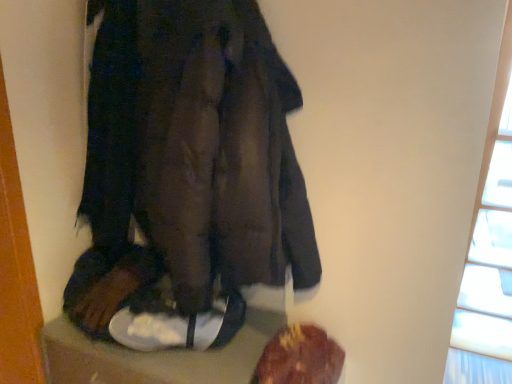
Describe the element at coordinates (188, 175) in the screenshot. I see `dark brown leather coat at center` at that location.

You are a GUI agent. You are given a task and a screenshot of the screen. Output one action in this format:
    pyautogui.click(x=<x>, y=<y>)
    Task: Click on the transparent glass window at upper right
    The width and height of the screenshot is (512, 384).
    Given the screenshot: What is the action you would take?
    pyautogui.click(x=487, y=271)

Measure the distance between point (291, 329) and camera.

The distance of point (291, 329) from camera is 4.53 feet.

Where is `dark brown leather coat at center`? dark brown leather coat at center is located at coordinates (188, 175).

Which of these two, brown crumbly bread at lower right or dark brown leather coat at center, is bigger?

Bigger between the two is dark brown leather coat at center.

Can dark brown leather coat at center be found inside brown crumbly bread at lower right?

That's incorrect, dark brown leather coat at center is not inside brown crumbly bread at lower right.

Looking at this image, between brown crumbly bread at lower right and dark brown leather coat at center, which one has larger width?

dark brown leather coat at center.

What's the angular difference between brown crumbly bread at lower right and dark brown leather coat at center's facing directions?

The angular difference between brown crumbly bread at lower right and dark brown leather coat at center is 0.000512 degrees.

Which is behind, point (480, 207) or point (298, 346)?

The point (480, 207) is farther.

Is transparent glass window at upper right located outside brown crumbly bread at lower right?

That's correct, transparent glass window at upper right is outside of brown crumbly bread at lower right.

Consider the image. How different are the orientations of transparent glass window at upper right and brown crumbly bread at lower right in degrees?

The angular difference between transparent glass window at upper right and brown crumbly bread at lower right is 180 degrees.

Which object is thinner, transparent glass window at upper right or brown crumbly bread at lower right?

brown crumbly bread at lower right.

Between dark brown leather coat at center and brown crumbly bread at lower right, which one is positioned in front?

dark brown leather coat at center.

Would you consider dark brown leather coat at center to be distant from brown crumbly bread at lower right?

They are positioned close to each other.

Considering the points (282, 280) and (314, 364), which point is in front, point (282, 280) or point (314, 364)?

The point (282, 280) is closer to the camera.

Would you say dark brown leather coat at center is inside or outside brown crumbly bread at lower right?

dark brown leather coat at center is spatially situated outside brown crumbly bread at lower right.

Does transparent glass window at upper right have a greater height compared to dark brown leather coat at center?

Yes, transparent glass window at upper right is taller than dark brown leather coat at center.

Considering the points (457, 346) and (298, 278), which point is behind, point (457, 346) or point (298, 278)?

Point (457, 346)

Considering the relative sizes of transparent glass window at upper right and dark brown leather coat at center in the image provided, is transparent glass window at upper right smaller than dark brown leather coat at center?

No.

Find the location of a particular element. This screenshot has width=512, height=384. window below the dark brown leather coat at center (from the image's perspective) is located at coordinates (487, 271).

Can you confirm if dark brown leather coat at center is shorter than transparent glass window at upper right?

Correct, dark brown leather coat at center is not as tall as transparent glass window at upper right.

Considering the positions of objects dark brown leather coat at center and transparent glass window at upper right in the image provided, who is behind, dark brown leather coat at center or transparent glass window at upper right?

transparent glass window at upper right is more distant.

Is dark brown leather coat at center looking in the opposite direction of transparent glass window at upper right?

No, transparent glass window at upper right is not at the back of dark brown leather coat at center.

Can you tell me how much brown crumbly bread at lower right and transparent glass window at upper right differ in facing direction?

There is a 180-degree angle between the facing directions of brown crumbly bread at lower right and transparent glass window at upper right.

Who is smaller, brown crumbly bread at lower right or transparent glass window at upper right?

With smaller size is brown crumbly bread at lower right.

Where is `food behind the transparent glass window at upper right`? This screenshot has width=512, height=384. food behind the transparent glass window at upper right is located at coordinates (300, 357).

Is brown crumbly bread at lower right positioned far away from transparent glass window at upper right?

brown crumbly bread at lower right is positioned a significant distance from transparent glass window at upper right.

I want to click on food lying behind the dark brown leather coat at center, so click(x=300, y=357).

Locate an element on the screen. The image size is (512, 384). window in front of the brown crumbly bread at lower right is located at coordinates (487, 271).

Looking at the image, which one is located closer to brown crumbly bread at lower right, dark brown leather coat at center or transparent glass window at upper right?

dark brown leather coat at center.

Looking at the image, which one is located further to dark brown leather coat at center, transparent glass window at upper right or brown crumbly bread at lower right?

transparent glass window at upper right is further to dark brown leather coat at center.

Looking at this image, from the image, which object appears to be farther from transparent glass window at upper right, brown crumbly bread at lower right or dark brown leather coat at center?

dark brown leather coat at center lies further to transparent glass window at upper right than the other object.

Based on the photo, looking at the image, which one is located closer to dark brown leather coat at center, brown crumbly bread at lower right or transparent glass window at upper right?

brown crumbly bread at lower right is positioned closer to the anchor dark brown leather coat at center.

Considering their positions, is dark brown leather coat at center positioned further to transparent glass window at upper right than brown crumbly bread at lower right?

dark brown leather coat at center is positioned further to the anchor transparent glass window at upper right.

Looking at the image, which one is located further to brown crumbly bread at lower right, transparent glass window at upper right or dark brown leather coat at center?

Among the two, transparent glass window at upper right is located further to brown crumbly bread at lower right.

The image size is (512, 384). In order to click on food situated between dark brown leather coat at center and transparent glass window at upper right from left to right in this screenshot , I will do `click(300, 357)`.